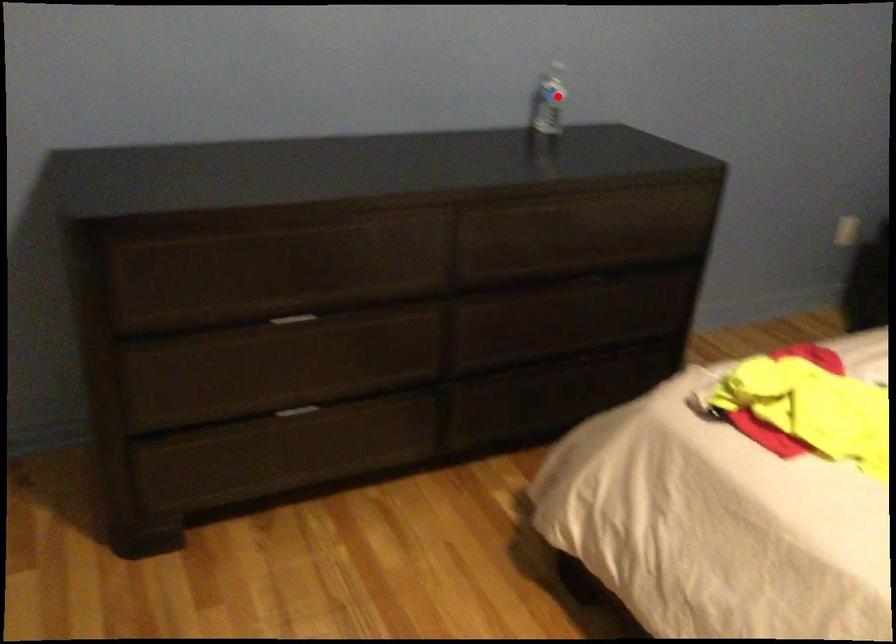
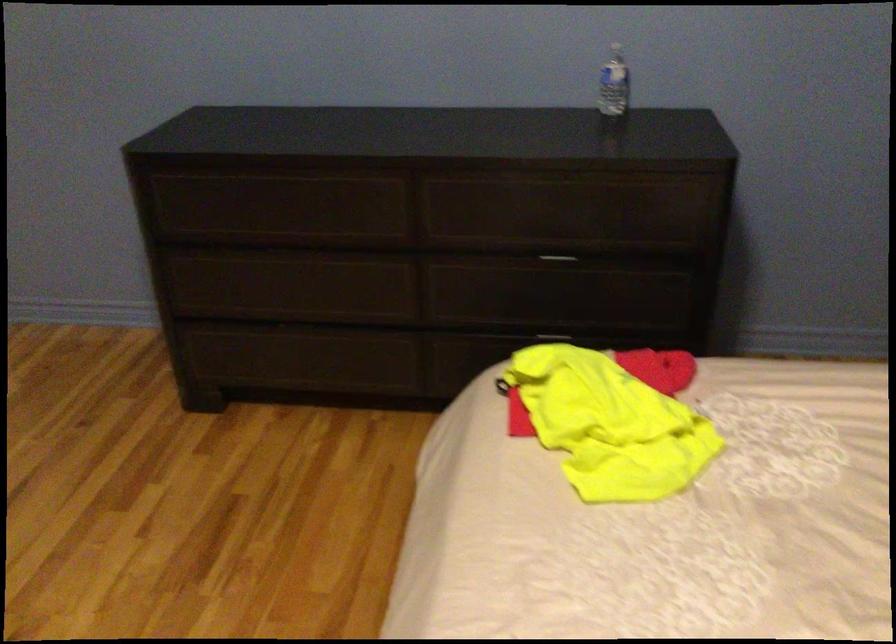
Where in the second image is the point corresponding to the highlighted location from the first image?

(614, 84)